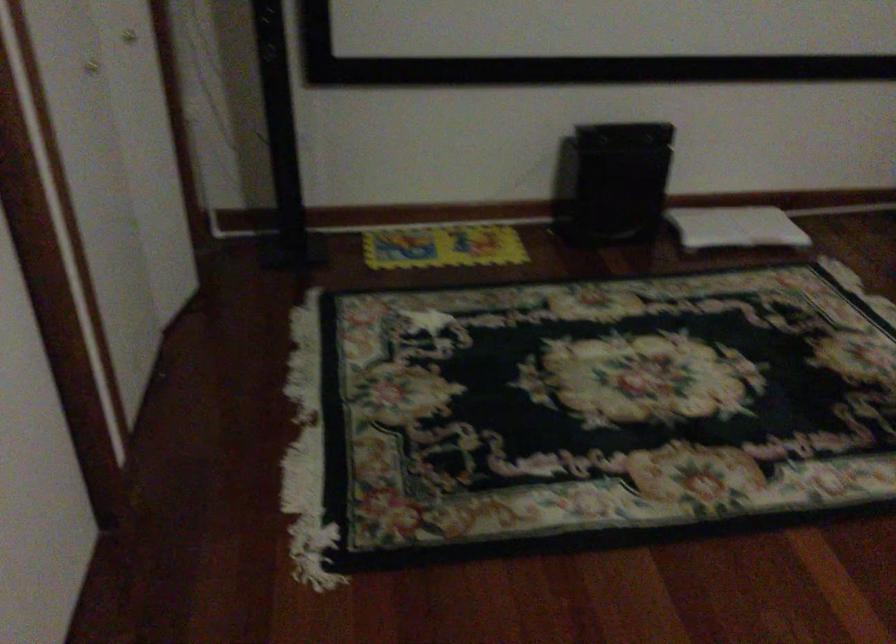
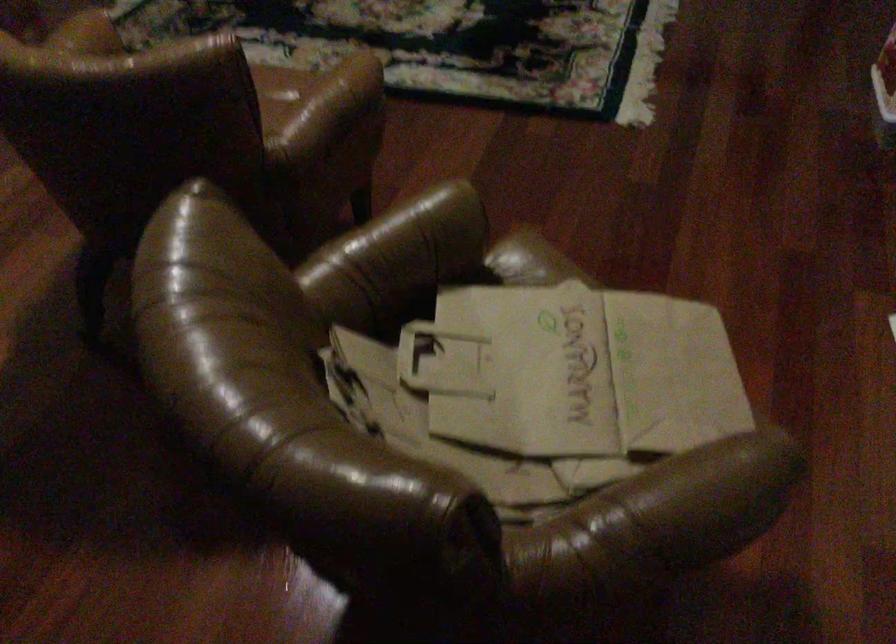
Question: What movement of the cameraman would produce the second image?

Choices:
 (A) Left
 (B) Right
 (C) Forward
 (D) Backward

Answer: (B)